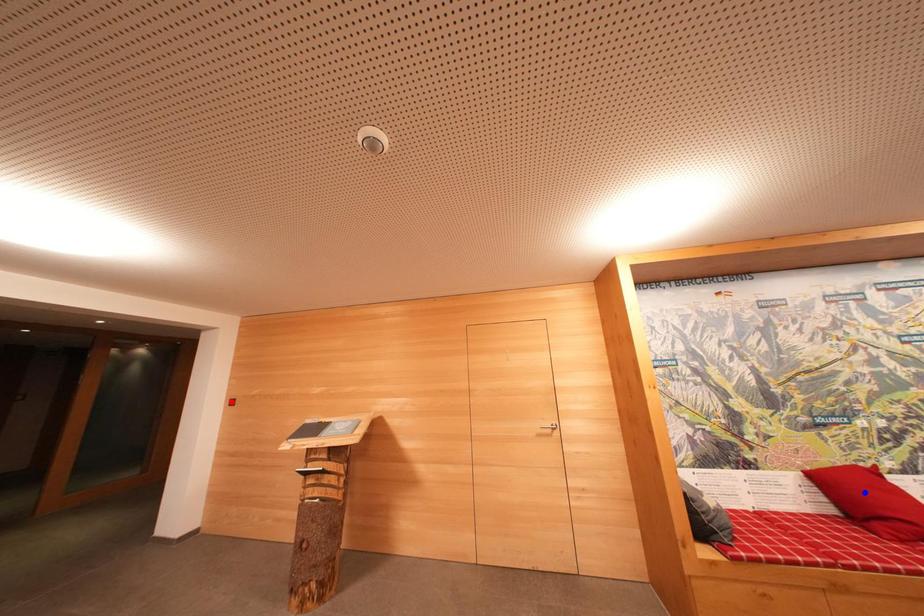
Question: Which of the two points in the image is closer to the camera?

Choices:
 (A) Blue point is closer.
 (B) Red point is closer.

Answer: (A)